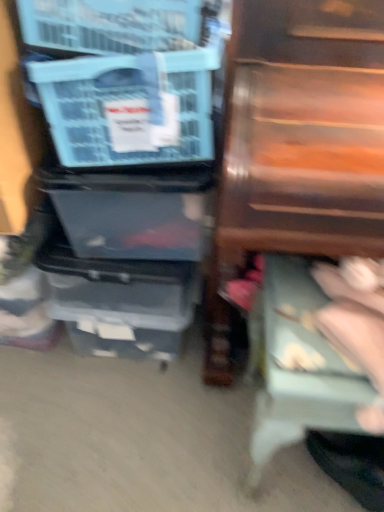
Where is `light blue fabric step stool at lower right`? light blue fabric step stool at lower right is located at coordinates (298, 367).

Locate an element on the screen. This screenshot has height=512, width=384. wooden drawer at right is located at coordinates (298, 141).

What's the angular difference between wooden drawer at right and light blue fabric step stool at lower right's facing directions?

The facing directions of wooden drawer at right and light blue fabric step stool at lower right are 177 degrees apart.

Considering the sizes of wooden drawer at right and light blue fabric step stool at lower right in the image, is wooden drawer at right taller or shorter than light blue fabric step stool at lower right?

wooden drawer at right is taller than light blue fabric step stool at lower right.

Where is `step stool that is behind the wooden drawer at right`? step stool that is behind the wooden drawer at right is located at coordinates (298, 367).

Which object is more forward, wooden drawer at right or light blue fabric step stool at lower right?

wooden drawer at right is closer to the camera.

Measure the distance from wooden drawer at right to blue plastic storage box at left.

wooden drawer at right and blue plastic storage box at left are 8.55 inches apart.

Between wooden drawer at right and blue plastic storage box at left, which one has smaller width?

blue plastic storage box at left is thinner.

Can you confirm if wooden drawer at right is positioned to the right of blue plastic storage box at left?

Yes, wooden drawer at right is to the right of blue plastic storage box at left.

Would you say wooden drawer at right contains blue plastic storage box at left?

Definitely not — blue plastic storage box at left is not inside wooden drawer at right.

From the image's perspective, between blue plastic storage box at left and light blue fabric step stool at lower right, who is located below?

light blue fabric step stool at lower right is shown below in the image.

In terms of height, does blue plastic storage box at left look taller or shorter compared to light blue fabric step stool at lower right?

In the image, blue plastic storage box at left appears to be shorter than light blue fabric step stool at lower right.

From a real-world perspective, relative to light blue fabric step stool at lower right, is blue plastic storage box at left vertically above or below?

From a real-world perspective, blue plastic storage box at left is physically above light blue fabric step stool at lower right.

Locate an element on the screen. Image resolution: width=384 pixels, height=512 pixels. storage box that is above the light blue fabric step stool at lower right (from a real-world perspective) is located at coordinates (123, 80).

Can you confirm if light blue fabric step stool at lower right is positioned to the left of blue plastic storage box at left?

In fact, light blue fabric step stool at lower right is to the right of blue plastic storage box at left.

Is light blue fabric step stool at lower right facing away from blue plastic storage box at left?

No, blue plastic storage box at left is not at the back of light blue fabric step stool at lower right.

How many degrees apart are the facing directions of light blue fabric step stool at lower right and blue plastic storage box at left?

177 degrees.

Is light blue fabric step stool at lower right taller than blue plastic storage box at left?

Yes, light blue fabric step stool at lower right is taller than blue plastic storage box at left.

From the image's perspective, does light blue fabric step stool at lower right appear higher than wooden drawer at right?

No, from the image's perspective, light blue fabric step stool at lower right is not over wooden drawer at right.

From a real-world perspective, is light blue fabric step stool at lower right positioned under wooden drawer at right based on gravity?

Yes.

Is light blue fabric step stool at lower right looking in the opposite direction of wooden drawer at right?

That's not correct — light blue fabric step stool at lower right is not looking away from wooden drawer at right.

Considering the sizes of blue plastic storage box at left and wooden drawer at right in the image, is blue plastic storage box at left taller or shorter than wooden drawer at right?

In the image, blue plastic storage box at left appears to be shorter than wooden drawer at right.

Is blue plastic storage box at left placed right next to wooden drawer at right?

No, blue plastic storage box at left is not next to wooden drawer at right.

Is blue plastic storage box at left wider than wooden drawer at right?

Incorrect, the width of blue plastic storage box at left does not surpass that of wooden drawer at right.

In the image, there is a wooden drawer at right. At what (x,y) coordinates should I click in order to perform the action: click on step stool below it (from the image's perspective). Please return your answer as a coordinate pair (x, y). The height and width of the screenshot is (512, 384). Looking at the image, I should click on (298, 367).

Where is `furniture below the blue plastic storage box at left (from a real-world perspective)`? Image resolution: width=384 pixels, height=512 pixels. furniture below the blue plastic storage box at left (from a real-world perspective) is located at coordinates (298, 141).

Estimate the real-world distances between objects in this image. Which object is further from blue plastic storage box at left, wooden drawer at right or light blue fabric step stool at lower right?

Among the two, light blue fabric step stool at lower right is located further to blue plastic storage box at left.

Looking at this image, from the image, which object appears to be farther from wooden drawer at right, blue plastic storage box at left or light blue fabric step stool at lower right?

light blue fabric step stool at lower right is further to wooden drawer at right.

Looking at this image, from the image, which object appears to be farther from light blue fabric step stool at lower right, wooden drawer at right or blue plastic storage box at left?

The object further to light blue fabric step stool at lower right is blue plastic storage box at left.

Looking at the image, which one is located closer to wooden drawer at right, light blue fabric step stool at lower right or blue plastic storage box at left?

Based on the image, blue plastic storage box at left appears to be nearer to wooden drawer at right.

Looking at the image, which one is located further to blue plastic storage box at left, light blue fabric step stool at lower right or wooden drawer at right?

light blue fabric step stool at lower right.

Looking at the image, which one is located closer to light blue fabric step stool at lower right, blue plastic storage box at left or wooden drawer at right?

wooden drawer at right is positioned closer to the anchor light blue fabric step stool at lower right.

You are a GUI agent. You are given a task and a screenshot of the screen. Output one action in this format:
    pyautogui.click(x=<x>, y=<y>)
    Task: Click on the furniture between blue plastic storage box at left and light blue fabric step stool at lower right in the vertical direction
    The height and width of the screenshot is (512, 384).
    Given the screenshot: What is the action you would take?
    pyautogui.click(x=298, y=141)